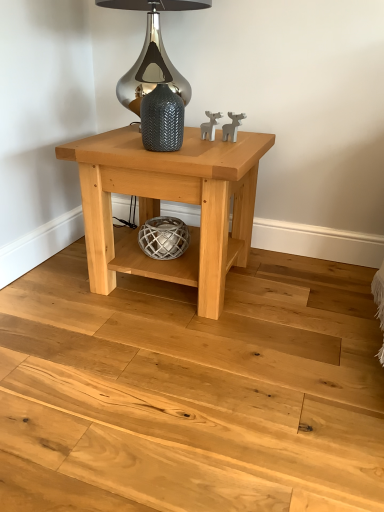
Find the location of a particular element. This screenshot has height=512, width=384. natural wood floor at center is located at coordinates (192, 391).

Measure the distance between point (76, 370) and camera.

Point (76, 370) is 1.22 meters away from camera.

Describe the element at coordinates (156, 76) in the screenshot. This screenshot has height=512, width=384. I see `satin silver glass at upper center` at that location.

At what (x,y) coordinates should I click in order to perform the action: click on textured gray vase at center. Please return your answer as a coordinate pair (x, y). Looking at the image, I should click on (162, 120).

From a real-world perspective, does natural wood table at center stand above textured gray vase at center?

Incorrect, from a real-world perspective, natural wood table at center is lower than textured gray vase at center.

Which of these two, natural wood table at center or textured gray vase at center, is wider?

natural wood table at center is wider.

Is natural wood table at center in contact with textured gray vase at center?

No.

Find the location of `table on the right of textured gray vase at center`. table on the right of textured gray vase at center is located at coordinates (170, 200).

Between satin silver glass at upper center and textured gray vase at center, which one appears on the left side from the viewer's perspective?

satin silver glass at upper center is more to the left.

Which of these two, satin silver glass at upper center or textured gray vase at center, is thinner?

textured gray vase at center is thinner.

From a real-world perspective, is satin silver glass at upper center under textured gray vase at center?

No, from a real-world perspective, satin silver glass at upper center is not under textured gray vase at center.

Between satin silver glass at upper center and textured gray vase at center, which one has larger size?

With larger size is satin silver glass at upper center.

Measure the distance from satin silver glass at upper center to natural wood table at center.

They are 47.43 centimeters apart.

Is point (118, 0) in front of point (217, 209)?

No, (118, 0) is behind (217, 209).

I want to click on table below the satin silver glass at upper center (from the image's perspective), so click(x=170, y=200).

From a real-world perspective, relative to natural wood table at center, is satin silver glass at upper center vertically above or below?

satin silver glass at upper center is above natural wood table at center.

Is textured gray vase at center bigger than natural wood floor at center?

No.

From a real-world perspective, is textured gray vase at center physically located above or below natural wood floor at center?

In terms of real-world spatial position, textured gray vase at center is above natural wood floor at center.

Between textured gray vase at center and natural wood floor at center, which one has less height?

→ Standing shorter between the two is natural wood floor at center.

Are textured gray vase at center and natural wood floor at center making contact?

No, textured gray vase at center is not with natural wood floor at center.

Which point is more forward, [159,103] or [93,482]?

The point [93,482] is closer to the camera.

Looking at their sizes, would you say satin silver glass at upper center is wider or thinner than natural wood floor at center?

Clearly, satin silver glass at upper center has less width compared to natural wood floor at center.

Is natural wood floor at center situated inside textured gray vase at center or outside?

natural wood floor at center is spatially situated outside textured gray vase at center.

I want to click on glass vase lying on the left of natural wood floor at center, so click(x=162, y=120).

Is natural wood floor at center positioned before textured gray vase at center?

Yes.

In the scene shown: Is natural wood floor at center facing towards textured gray vase at center?

No, natural wood floor at center is not turned towards textured gray vase at center.

Does natural wood floor at center have a greater height compared to natural wood table at center?

No.

From the image's perspective, is natural wood floor at center located above natural wood table at center?

No, from the image's perspective, natural wood floor at center is not over natural wood table at center.

Is point (132, 383) positioned behind point (113, 168)?

No, (132, 383) is closer to viewer.

Is natural wood floor at center not close to natural wood table at center?

No, natural wood floor at center is in close proximity to natural wood table at center.

The width and height of the screenshot is (384, 512). I want to click on table located on the right of textured gray vase at center, so click(x=170, y=200).

Where is `table lamp located above the textured gray vase at center (from a real-world perspective)`? table lamp located above the textured gray vase at center (from a real-world perspective) is located at coordinates pos(156,76).

Estimate the real-world distances between objects in this image. Which object is closer to satin silver glass at upper center, textured gray vase at center or natural wood table at center?

textured gray vase at center lies closer to satin silver glass at upper center than the other object.

Looking at the image, which one is located closer to natural wood table at center, natural wood floor at center or satin silver glass at upper center?

A: Among the two, natural wood floor at center is located nearer to natural wood table at center.

Which object lies nearer to the anchor point natural wood floor at center, natural wood table at center or textured gray vase at center?

natural wood table at center is positioned closer to the anchor natural wood floor at center.

Looking at the image, which one is located closer to natural wood floor at center, textured gray vase at center or natural wood table at center?

natural wood table at center is closer to natural wood floor at center.

Which object lies further to the anchor point satin silver glass at upper center, natural wood floor at center or textured gray vase at center?

Among the two, natural wood floor at center is located further to satin silver glass at upper center.

Estimate the real-world distances between objects in this image. Which object is closer to textured gray vase at center, natural wood table at center or natural wood floor at center?

natural wood table at center is closer to textured gray vase at center.

Which object lies further to the anchor point natural wood table at center, natural wood floor at center or textured gray vase at center?

natural wood floor at center is positioned further to the anchor natural wood table at center.

Considering their positions, is satin silver glass at upper center positioned closer to natural wood table at center than textured gray vase at center?

textured gray vase at center is closer to natural wood table at center.

At what (x,y) coordinates should I click in order to perform the action: click on glass vase that lies between satin silver glass at upper center and natural wood floor at center from top to bottom. Please return your answer as a coordinate pair (x, y). The height and width of the screenshot is (512, 384). Looking at the image, I should click on (162, 120).

Where is `glass vase between satin silver glass at upper center and natural wood table at center from top to bottom`? The image size is (384, 512). glass vase between satin silver glass at upper center and natural wood table at center from top to bottom is located at coordinates (162, 120).

Locate an element on the screen. The height and width of the screenshot is (512, 384). table between satin silver glass at upper center and natural wood floor at center in the vertical direction is located at coordinates (170, 200).

The image size is (384, 512). Identify the location of table between textured gray vase at center and natural wood floor at center vertically. (170, 200).